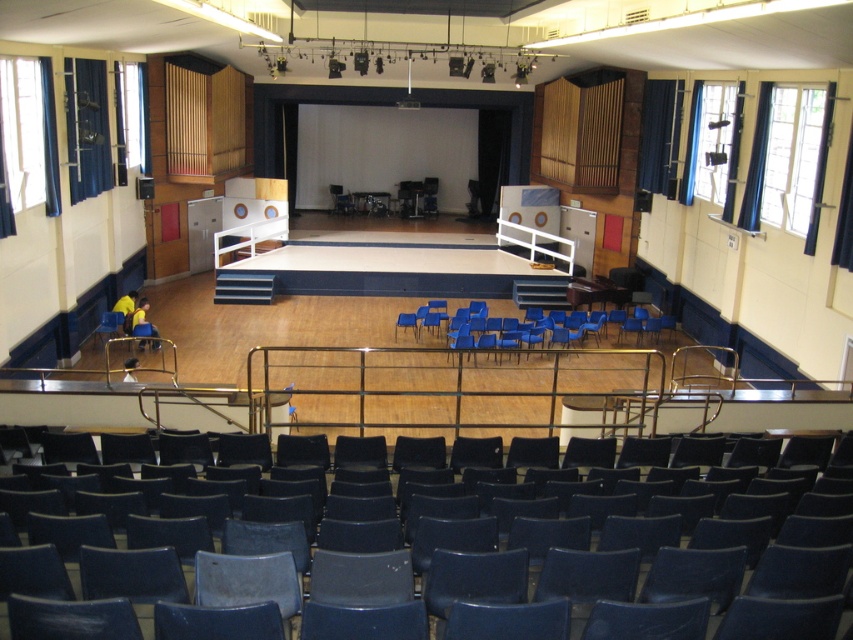
Can you confirm if matte blue chair at center is bigger than blue plastic chair at lower left?

Yes, matte blue chair at center is bigger than blue plastic chair at lower left.

Is matte blue chair at center to the left of blue plastic chair at lower left from the viewer's perspective?

Incorrect, matte blue chair at center is not on the left side of blue plastic chair at lower left.

Where is `matte blue chair at center`? This screenshot has height=640, width=853. matte blue chair at center is located at coordinates (798, 576).

Is blue plastic chairs at center to the right of blue plastic chair at center from the viewer's perspective?

Yes, blue plastic chairs at center is to the right of blue plastic chair at center.

Who is more forward, [440,304] or [339,198]?

Point [440,304]

Is point (598, 321) farther from viewer compared to point (337, 192)?

No, (598, 321) is in front of (337, 192).

The image size is (853, 640). In order to click on blue plastic chairs at center in this screenshot , I will do `click(490, 324)`.

Is blue plastic chairs at center bigger than blue plastic chair at lower left?

Correct, blue plastic chairs at center is larger in size than blue plastic chair at lower left.

Between blue plastic chairs at center and blue plastic chair at lower left, which one has less height?

blue plastic chair at lower left

I want to click on blue plastic chairs at center, so click(490, 324).